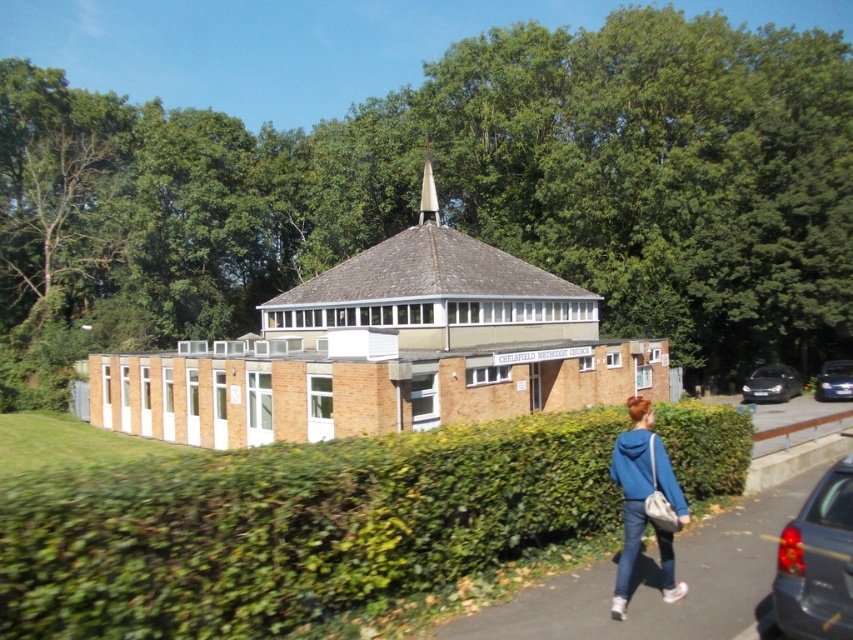
Does gray asphalt pavement at lower right have a lesser height compared to metallic gray sedan at lower right?

Correct, gray asphalt pavement at lower right is not as tall as metallic gray sedan at lower right.

How much distance is there between gray asphalt pavement at lower right and metallic gray sedan at lower right?

They are 38.52 inches apart.

What do you see at coordinates (657, 582) in the screenshot? The height and width of the screenshot is (640, 853). I see `gray asphalt pavement at lower right` at bounding box center [657, 582].

At what (x,y) coordinates should I click in order to perform the action: click on gray asphalt pavement at lower right. Please return your answer as a coordinate pair (x, y). Image resolution: width=853 pixels, height=640 pixels. Looking at the image, I should click on (657, 582).

Can you confirm if metallic gray sedan at lower right is thinner than smooth silver spire at upper center?

Yes, metallic gray sedan at lower right is thinner than smooth silver spire at upper center.

Who is more distant from viewer, (x=851, y=561) or (x=425, y=152)?

The point (x=425, y=152) is behind.

The image size is (853, 640). Identify the location of metallic gray sedan at lower right. (817, 561).

Who is taller, blue fleece sweatshirt at lower right or shiny black sedan at right?

shiny black sedan at right is taller.

Between blue fleece sweatshirt at lower right and shiny black sedan at right, which one has less height?

With less height is blue fleece sweatshirt at lower right.

Between point (659, 442) and point (846, 364), which one is positioned in front?

Positioned in front is point (659, 442).

Where is `blue fleece sweatshirt at lower right`? Image resolution: width=853 pixels, height=640 pixels. blue fleece sweatshirt at lower right is located at coordinates (631, 465).